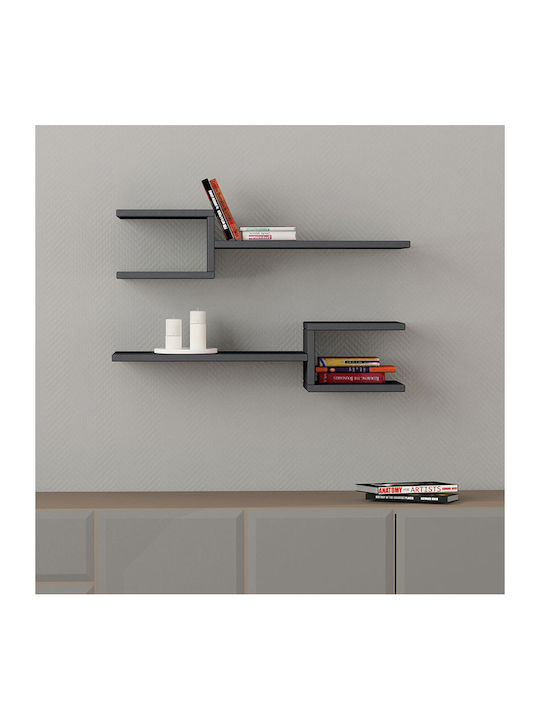
At what (x,y) coordinates should I click in order to perform the action: click on books. Please return your answer as a coordinate pair (x, y). Image resolution: width=540 pixels, height=720 pixels. Looking at the image, I should click on pos(206,181), pos(215,183), pos(254,227), pos(255,233), pos(334,361), pos(335,368), pos(338,377), pos(406,487), pos(411,497).